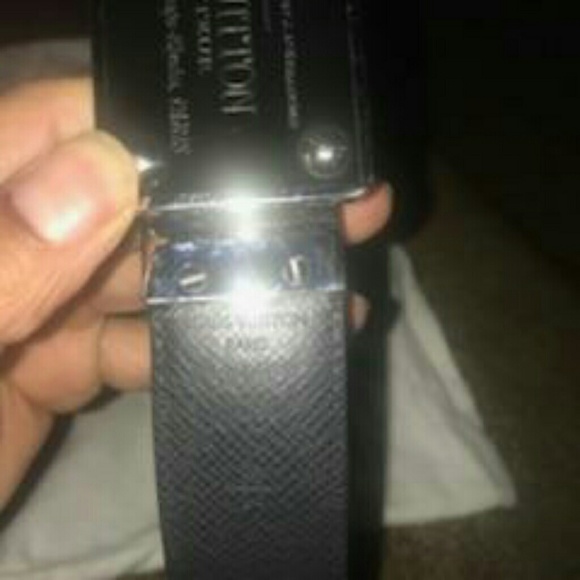
You are a GUI agent. You are given a task and a screenshot of the screen. Output one action in this format:
    pyautogui.click(x=<x>, y=<y>)
    Task: Click on the couch
    This screenshot has height=580, width=580.
    Given the screenshot: What is the action you would take?
    pyautogui.click(x=566, y=467), pyautogui.click(x=484, y=552), pyautogui.click(x=481, y=321)